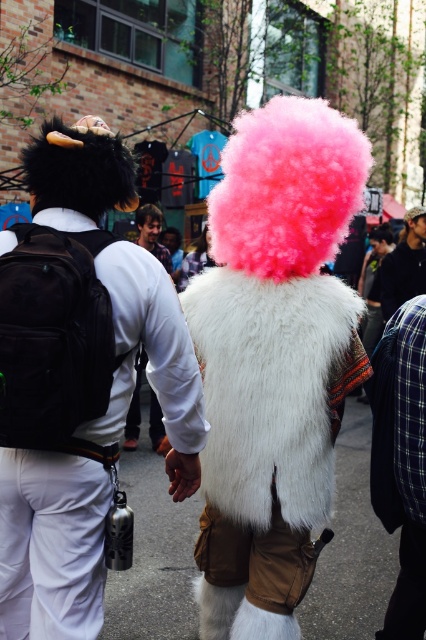
Question: Which of the following is the closest to the observer?

Choices:
 (A) white fur coat at center
 (B) dark blue plaid shirt at center
 (C) white furry vest at center
 (D) plaid fabric shirt at right

Answer: (C)

Question: Which is farther from the white fur coat at center?

Choices:
 (A) plaid fabric shirt at right
 (B) white furry vest at center
 (C) black fuzzy wig at upper left

Answer: (C)

Question: Considering the real-world distances, which object is farthest from the black fuzzy wig at upper left?

Choices:
 (A) pink fluffy wig at upper center
 (B) white fur coat at center

Answer: (A)

Question: Does white furry vest at center have a smaller size compared to black fuzzy wig at upper left?

Choices:
 (A) yes
 (B) no

Answer: (B)

Question: Is the position of white furry vest at center more distant than that of dark blue plaid shirt at center?

Choices:
 (A) yes
 (B) no

Answer: (B)

Question: From the image, what is the correct spatial relationship of fuzzy white fur coat at center in relation to black fuzzy wig at upper left?

Choices:
 (A) right
 (B) left

Answer: (A)